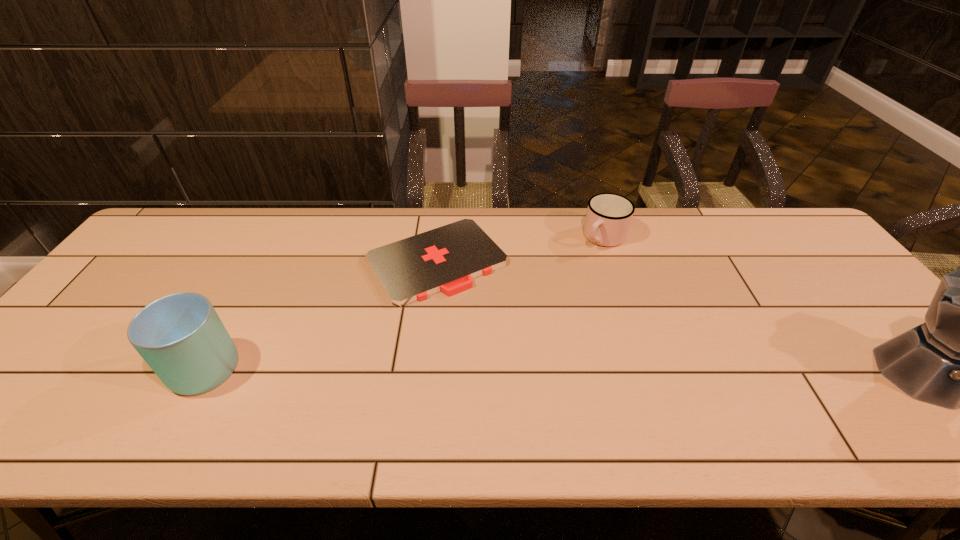
The image size is (960, 540). In order to click on the nearer mug in this screenshot , I will do (x=180, y=336).

At what (x,y) coordinates should I click in order to perform the action: click on the taller mug. Please return your answer as a coordinate pair (x, y). The image size is (960, 540). Looking at the image, I should click on (180, 336).

Where is `the farther mug`? This screenshot has width=960, height=540. the farther mug is located at coordinates (609, 215).

Image resolution: width=960 pixels, height=540 pixels. I want to click on the third tallest object, so click(x=609, y=215).

Where is `the shortest object`? the shortest object is located at coordinates 446,259.

Find the location of a particular element. the third object from right to left is located at coordinates (446, 259).

Locate an element on the screen. This screenshot has width=960, height=540. vacant region located on the back of the nearer mug is located at coordinates coord(268,245).

In order to click on vacant space located on the side of the third tallest object with the handle in this screenshot , I will do `click(567, 283)`.

What are the coordinates of `free region located on the side of the third tallest object with the handle` in the screenshot? It's located at (531, 325).

Locate an element on the screen. vacant space located on the side of the third tallest object with the handle is located at coordinates 565,285.